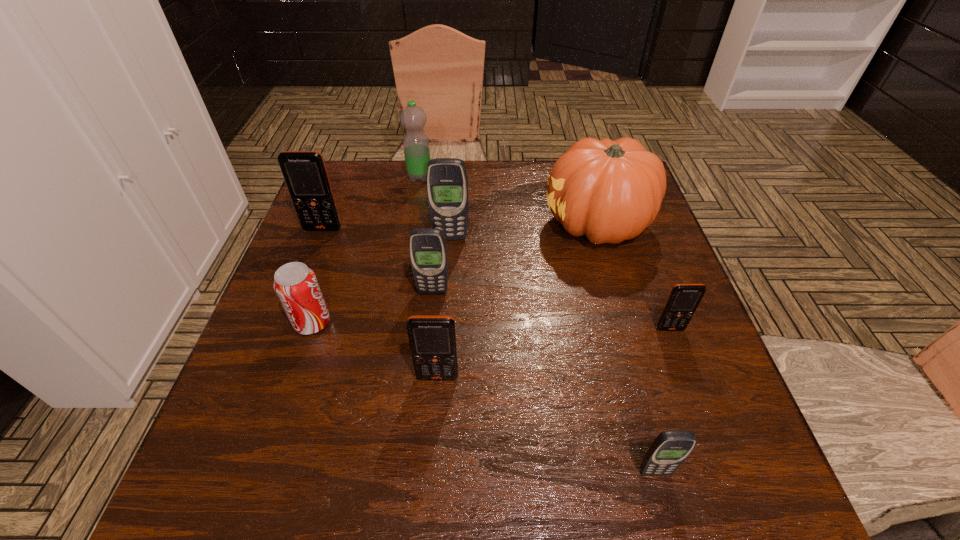
Image resolution: width=960 pixels, height=540 pixels. In order to click on the second nearest cellular telephone in this screenshot , I will do `click(432, 338)`.

The image size is (960, 540). I want to click on soda can, so click(295, 284).

Where is `the fourth farthest cellular telephone`? the fourth farthest cellular telephone is located at coordinates (684, 299).

At what (x,y) coordinates should I click in order to perform the action: click on the second nearest orange cellular telephone. Please return your answer as a coordinate pair (x, y). Image resolution: width=960 pixels, height=540 pixels. Looking at the image, I should click on (684, 299).

Find the location of a particular element. This screenshot has height=540, width=960. the rightmost gray cellular telephone is located at coordinates (668, 451).

I want to click on the nearest cellular telephone, so click(x=668, y=451).

Locate an element on the screen. free location located on the left of the farthest object is located at coordinates (371, 177).

Find the location of a particular element. The image size is (960, 540). vacant region located on the carved face of the pumpkin is located at coordinates (482, 224).

The image size is (960, 540). I want to click on vacant space located 0.240m on the carved face of the pumpkin, so click(x=452, y=224).

Locate an element on the screen. This screenshot has height=540, width=960. free space located on the carved face of the pumpkin is located at coordinates (460, 224).